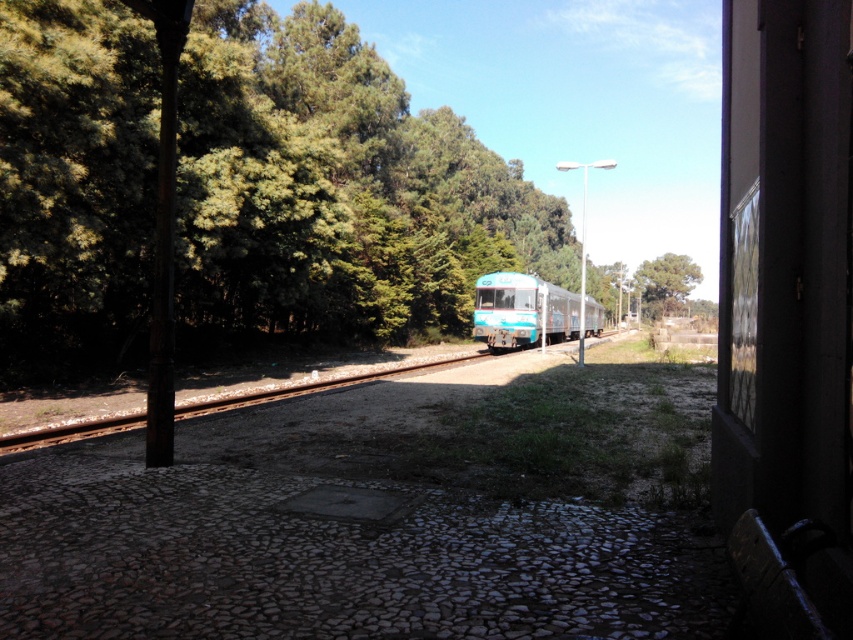
You are a railway engineer who needs to ensure the safety of the platform. The platform is 100 feet long. Can you determine if the teal glossy train at center will fit entirely on the platform when it stops?

The teal glossy train at center is 122.84 feet long, which is longer than the platform length of 100 feet. Therefore, the train will not fit entirely on the platform when it stops.

You are a railway worker standing on the platform. You need to ensure the distance between the teal glossy train at center and the green leafy tree at center is safe for the train to pass. The safety regulation requires at least 150 feet between them. Is the current distance compliant?

The teal glossy train at center is 183.46 feet from the green leafy tree at center, which exceeds the required 150 feet safety distance. Therefore, the current distance is compliant with safety regulations.